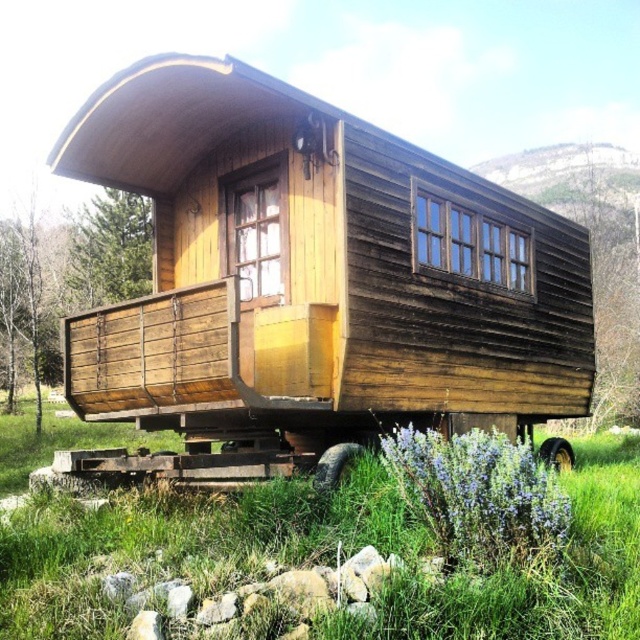
You are standing on the path leading to the weathered wood hut at center and the brown rubber wheel at lower right. Which object is closer to your left side?

The weathered wood hut at center is positioned on the left side of brown rubber wheel at lower right, so it is closer to your left side.

Based on the photo, you are standing in front of the weathered wood hut at center and notice a brown rubber wheel at lower right. Which object is larger in size?

The brown rubber wheel at lower right is larger in size compared to the weathered wood hut at center.